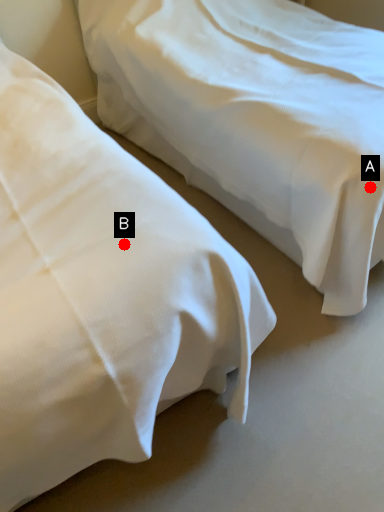
Question: Two points are circled on the image, labeled by A and B beside each circle. Among these points, which one is farthest from the camera?

Choices:
 (A) A is further
 (B) B is further

Answer: (A)